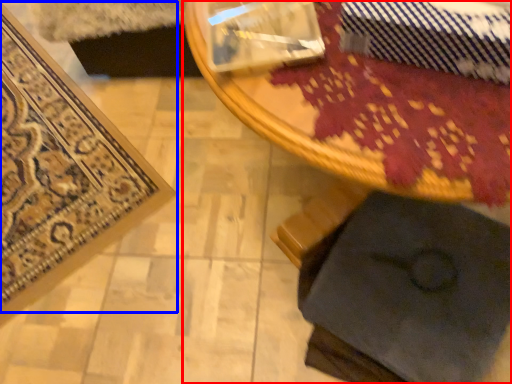
Question: Among these objects, which one is nearest to the camera, table (highlighted by a red box) or mat (highlighted by a blue box)?

Choices:
 (A) table
 (B) mat

Answer: (A)